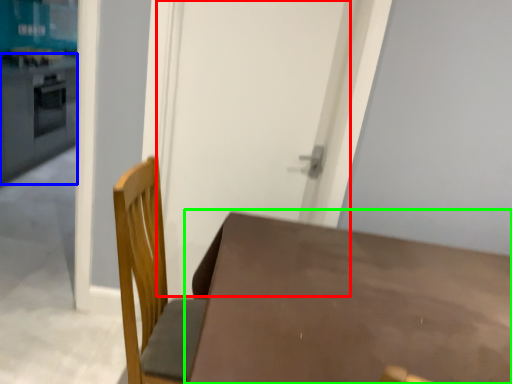
Question: Which object is the farthest from screen door (highlighted by a red box)? Choose among these: counter top (highlighted by a blue box) or table (highlighted by a green box).

Choices:
 (A) counter top
 (B) table

Answer: (A)